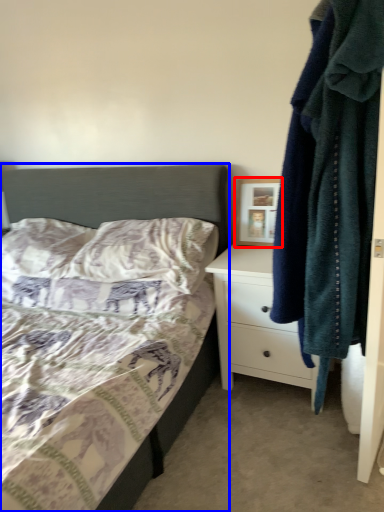
Question: Among these objects, which one is farthest to the camera, picture frame (highlighted by a red box) or bed (highlighted by a blue box)?

Choices:
 (A) picture frame
 (B) bed

Answer: (A)